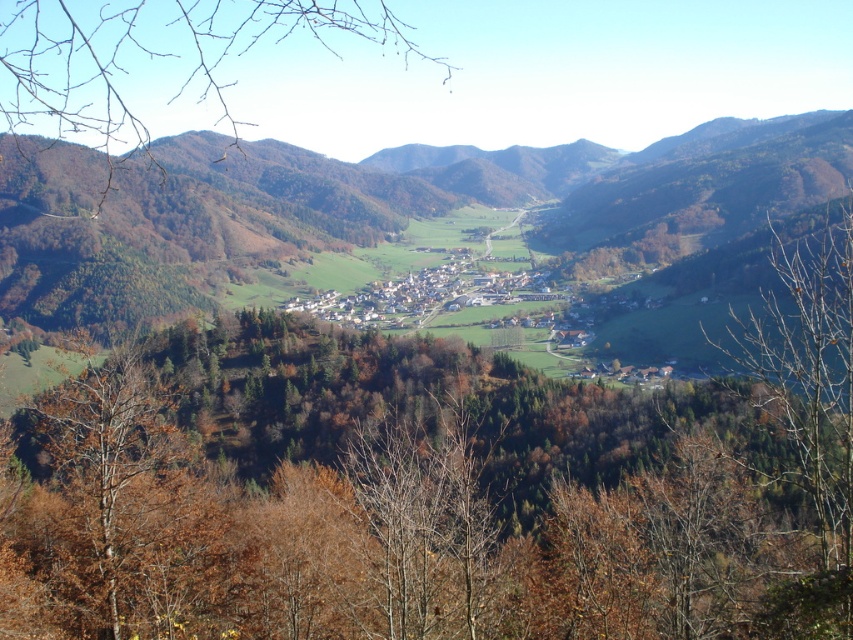
You are standing at the valley viewpoint and want to reach a specific point marked as point (131,540). If your current distance to the valley is 100 meters, can you estimate whether the point is closer to you or further away than the valley itself?

The distance of point (131,540) from viewer is 69.19 meters, which is less than 100 meters. Therefore, the point is closer to you than the valley itself.

You are standing in the valley and want to take a photo of both the brown leafy tree at center and the brown leafy tree at left. Which tree should you position closer to the camera to include both in the frame without cropping?

To include both the brown leafy tree at center and the brown leafy tree at left in the frame without cropping, you should position the brown leafy tree at center closer to the camera since it is shorter than the brown leafy tree at left.